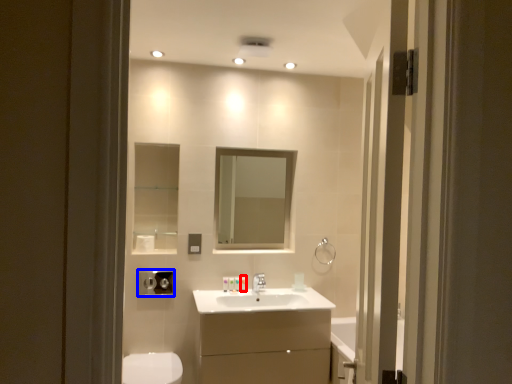
Question: Which point is further to the camera, toiletry (highlighted by a red box) or hand dryer (highlighted by a blue box)?

Choices:
 (A) toiletry
 (B) hand dryer

Answer: (A)